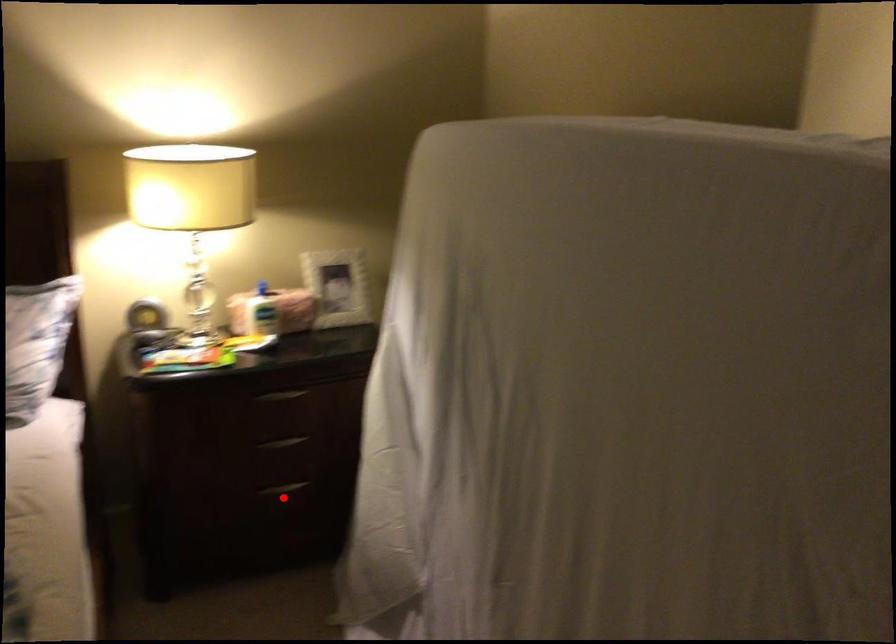
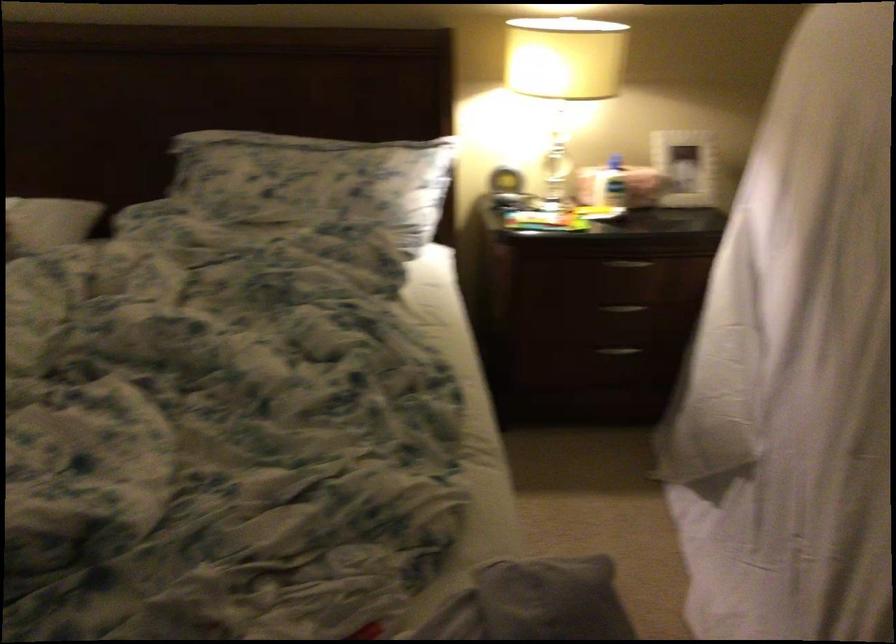
The point at the highlighted location is marked in the first image. Where is the corresponding point in the second image?

(616, 355)